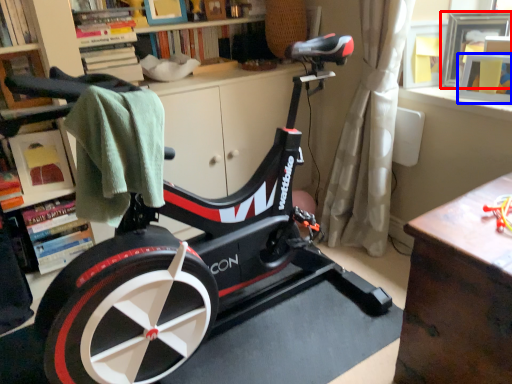
Question: Which object is further to the camera taking this photo, picture frame (highlighted by a red box) or picture frame (highlighted by a blue box)?

Choices:
 (A) picture frame
 (B) picture frame

Answer: (A)